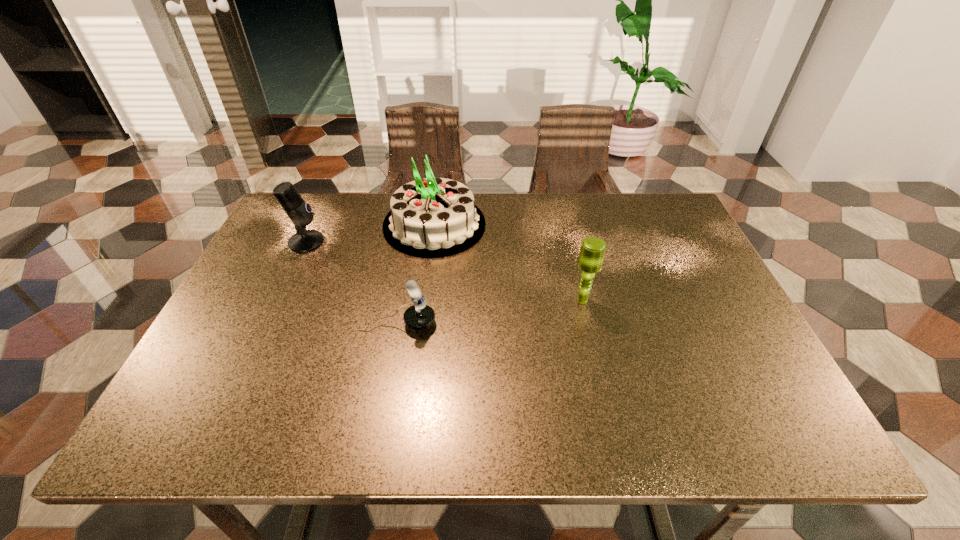
Image resolution: width=960 pixels, height=540 pixels. I want to click on vacant space at the near right corner, so pyautogui.click(x=803, y=434).

The width and height of the screenshot is (960, 540). I want to click on free spot between the second microphone from left to right and the rightmost object, so click(x=491, y=312).

Locate an element on the screen. Image resolution: width=960 pixels, height=540 pixels. vacant space in between the birthday cake and the shortest microphone is located at coordinates (416, 274).

This screenshot has height=540, width=960. Identify the location of empty space that is in between the farthest microphone and the birthday cake. (371, 233).

Locate an element on the screen. The width and height of the screenshot is (960, 540). vacant area that lies between the rightmost object and the leftmost microphone is located at coordinates (444, 271).

At what (x,y) coordinates should I click in order to perform the action: click on free spot between the birthday cake and the leftmost microphone. Please return your answer as a coordinate pair (x, y). Looking at the image, I should click on (371, 233).

Identify the location of unoccupied position between the rightmost microphone and the nearest object. The image size is (960, 540). (491, 312).

Locate an element on the screen. This screenshot has width=960, height=540. free space that is in between the third farthest object and the birthday cake is located at coordinates (509, 262).

The image size is (960, 540). What are the coordinates of `vacant space in between the farthest microphone and the birthday cake` in the screenshot? It's located at (371, 233).

Find the location of a particular element. This screenshot has width=960, height=540. vacant area that lies between the second microphone from right to left and the second nearest object is located at coordinates (491, 312).